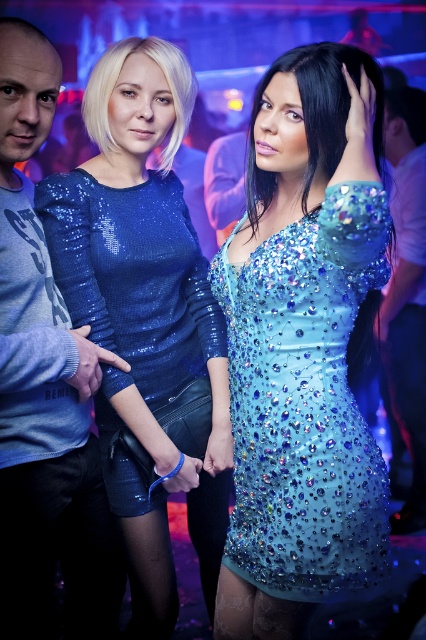
Is the position of light blue sweatshirt at left more distant than that of white glossy shirt at right?

No, it is in front of white glossy shirt at right.

Does light blue sweatshirt at left appear on the right side of white glossy shirt at right?

In fact, light blue sweatshirt at left is to the left of white glossy shirt at right.

The width and height of the screenshot is (426, 640). What are the coordinates of `light blue sweatshirt at left` in the screenshot? It's located at coord(45,390).

At what (x,y) coordinates should I click in order to perform the action: click on light blue sweatshirt at left. Please return your answer as a coordinate pair (x, y). Looking at the image, I should click on (45, 390).

Between blue sequined dress at center and sequined blue dress at center, which one appears on the right side from the viewer's perspective?

sequined blue dress at center is more to the right.

Does point (126, 276) come farther from viewer compared to point (314, 595)?

That is True.

Find the location of `blue sequined dress at center`. blue sequined dress at center is located at coordinates (143, 310).

Does point (273, 528) come in front of point (51, 100)?

Yes, it is.

Can you confirm if sequined blue dress at center is positioned below light blue sweatshirt at left?

Correct, sequined blue dress at center is located below light blue sweatshirt at left.

Does point (247, 294) lie behind point (65, 323)?

No, it is in front of (65, 323).

The image size is (426, 640). I want to click on sequined blue dress at center, so click(305, 404).